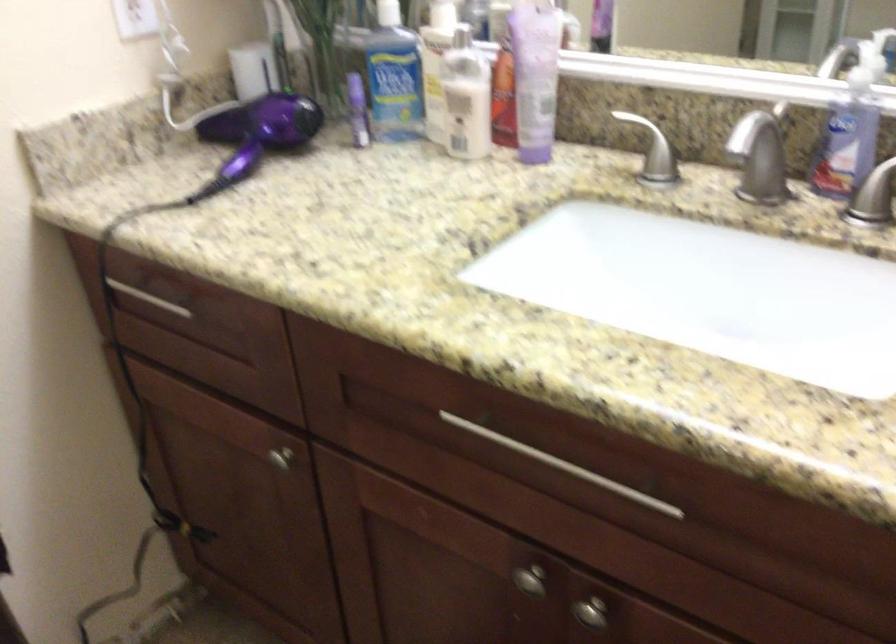
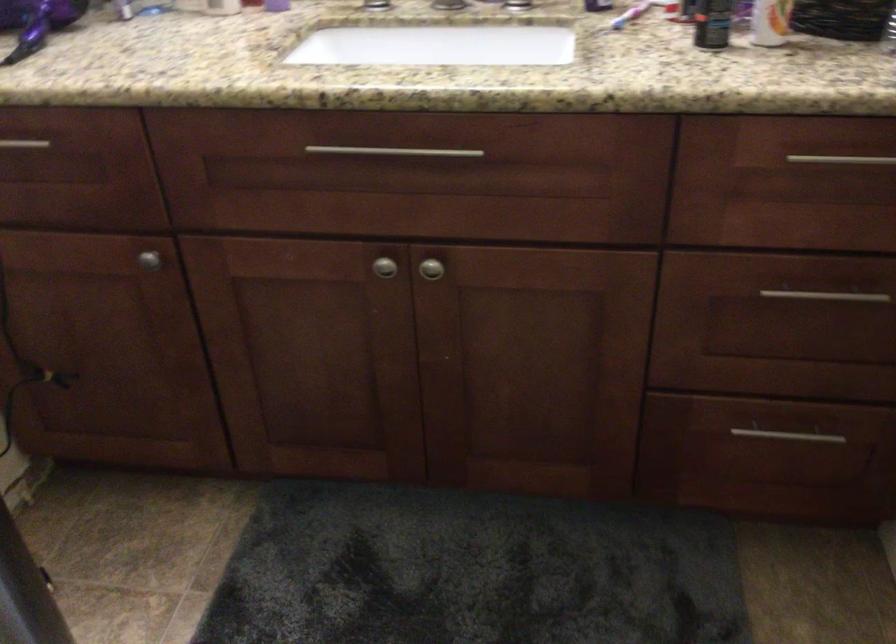
Locate, in the second image, the point that corresponds to point (526, 573) in the first image.

(383, 267)